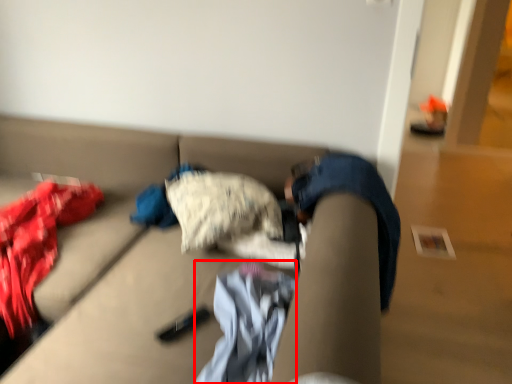
Question: From the image's perspective, what is the correct spatial relationship of baby clothe (annotated by the red box) in relation to studio couch?

Choices:
 (A) above
 (B) below

Answer: (B)